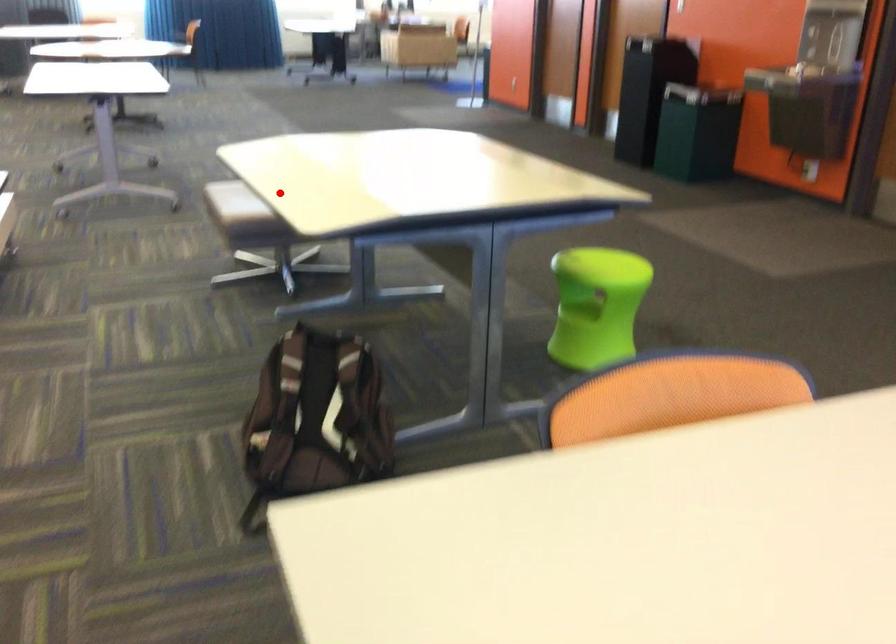
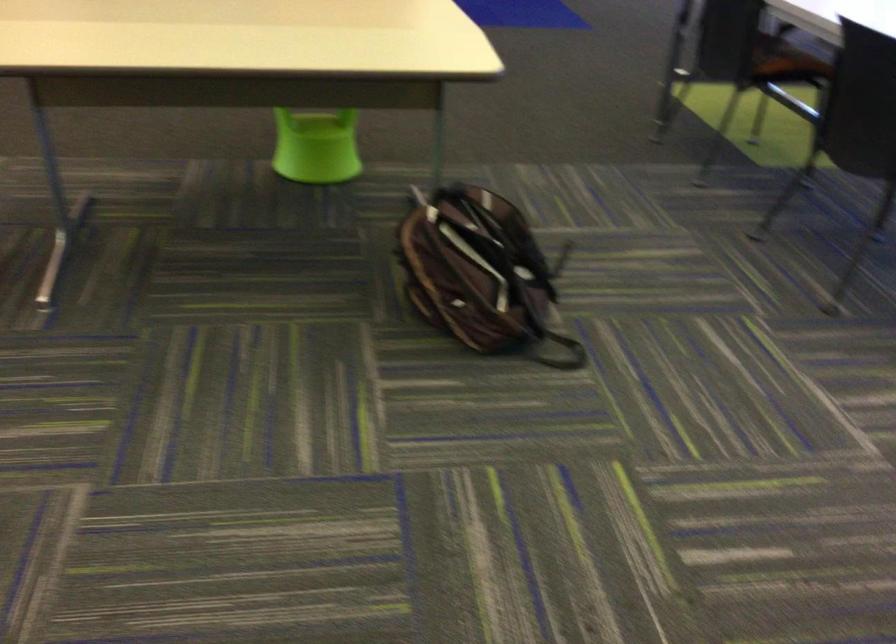
Locate, in the second image, the point that corresponds to the highlighted location in the first image.

(322, 67)